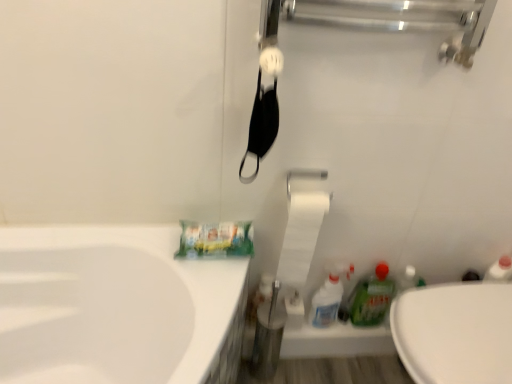
Question: Can you confirm if white glossy spray bottle at lower right, placed as the first cleaning product when sorted from left to right, is shorter than green glossy bottle at lower right, the 1th cleaning product in the right-to-left sequence?

Choices:
 (A) no
 (B) yes

Answer: (A)

Question: Does white glossy spray bottle at lower right, placed as the first cleaning product when sorted from left to right, have a greater height compared to green glossy bottle at lower right, placed as the 2th cleaning product when sorted from left to right?

Choices:
 (A) no
 (B) yes

Answer: (B)

Question: Is white glossy spray bottle at lower right, the second cleaning product viewed from the right, facing away from green glossy bottle at lower right, placed as the 2th cleaning product when sorted from left to right?

Choices:
 (A) no
 (B) yes

Answer: (A)

Question: Is white glossy spray bottle at lower right, placed as the first cleaning product when sorted from left to right, oriented towards green glossy bottle at lower right, placed as the 2th cleaning product when sorted from left to right?

Choices:
 (A) yes
 (B) no

Answer: (B)

Question: From the image's perspective, is white glossy spray bottle at lower right, placed as the first cleaning product when sorted from left to right, under green glossy bottle at lower right, the 1th cleaning product in the right-to-left sequence?

Choices:
 (A) no
 (B) yes

Answer: (B)

Question: Does white glossy spray bottle at lower right, placed as the first cleaning product when sorted from left to right, have a greater width compared to green glossy bottle at lower right, the 1th cleaning product in the right-to-left sequence?

Choices:
 (A) no
 (B) yes

Answer: (B)

Question: From the image's perspective, is white matte toilet paper at center located beneath green glossy bottle at lower right, placed as the 2th cleaning product when sorted from left to right?

Choices:
 (A) no
 (B) yes

Answer: (A)

Question: From a real-world perspective, does white matte toilet paper at center sit lower than green glossy bottle at lower right, placed as the 2th cleaning product when sorted from left to right?

Choices:
 (A) yes
 (B) no

Answer: (B)

Question: Considering the relative positions of white matte toilet paper at center and green glossy bottle at lower right, placed as the 2th cleaning product when sorted from left to right, in the image provided, is white matte toilet paper at center to the left of green glossy bottle at lower right, placed as the 2th cleaning product when sorted from left to right, from the viewer's perspective?

Choices:
 (A) no
 (B) yes

Answer: (B)

Question: Can you confirm if white matte toilet paper at center is shorter than green glossy bottle at lower right, the 1th cleaning product in the right-to-left sequence?

Choices:
 (A) yes
 (B) no

Answer: (B)

Question: Is the position of white matte toilet paper at center more distant than that of green glossy bottle at lower right, placed as the 2th cleaning product when sorted from left to right?

Choices:
 (A) no
 (B) yes

Answer: (A)

Question: Would you say white matte toilet paper at center is outside green glossy bottle at lower right, placed as the 2th cleaning product when sorted from left to right?

Choices:
 (A) no
 (B) yes

Answer: (B)

Question: From a real-world perspective, is white glossy spray bottle at lower right, the second cleaning product viewed from the right, located higher than white glossy toilet at lower right?

Choices:
 (A) yes
 (B) no

Answer: (A)